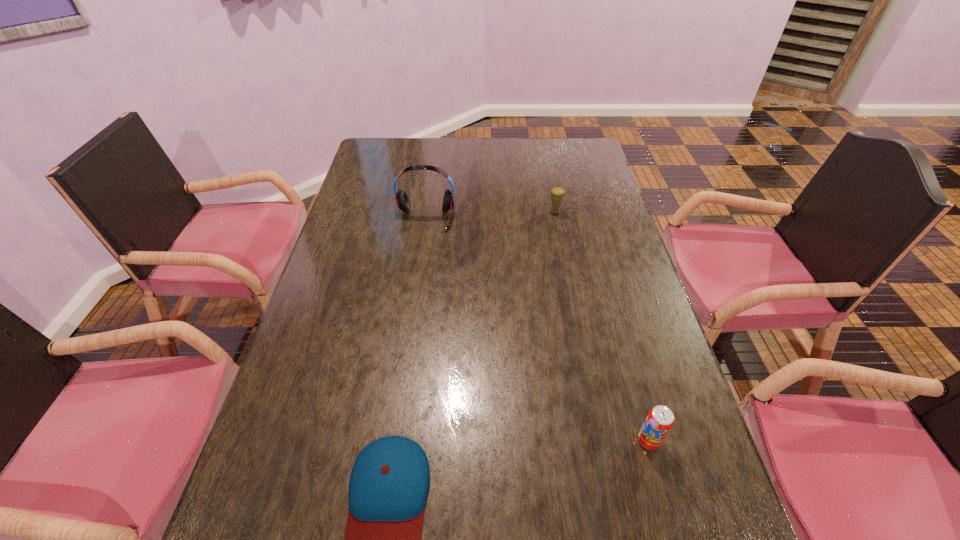
Where is `vacant space that satisfies the following two spatial constraints: 1. on the front side of the soda can; 2. on the left side of the second tallest object`? vacant space that satisfies the following two spatial constraints: 1. on the front side of the soda can; 2. on the left side of the second tallest object is located at coordinates (600, 441).